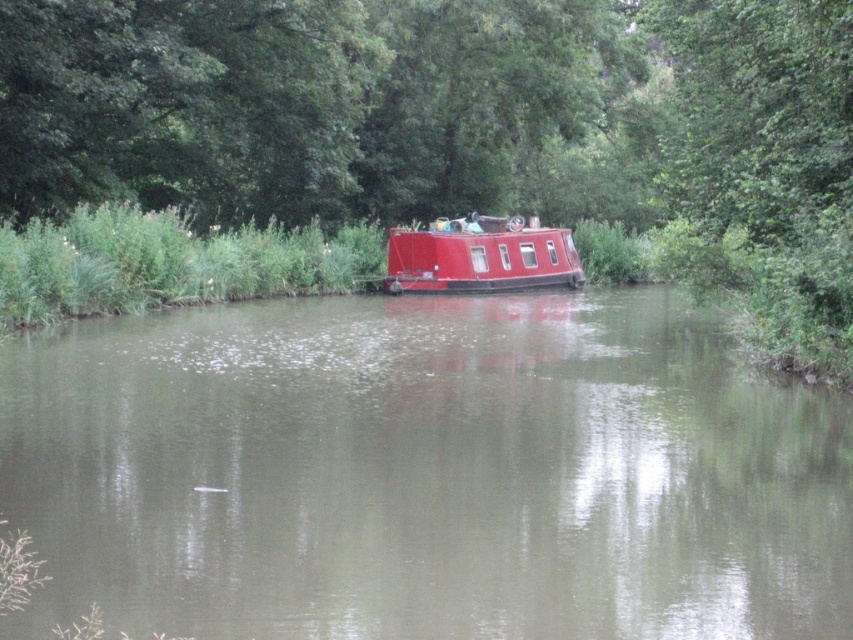
You are a tourist standing on the bank of the canal and want to take a photo of the shiny red boat at center and the smooth brown water at center. Which object should you focus on first if you want to capture both in one frame without moving the camera?

You should focus on the shiny red boat at center first because the smooth brown water at center is to the left of it, so by centering the boat in your frame, you can ensure both objects are included without moving the camera.